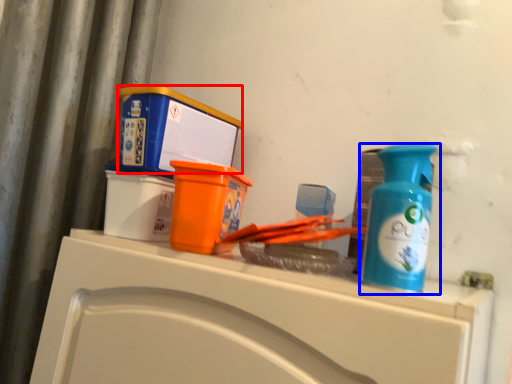
Question: Which object is further to the camera taking this photo, box (highlighted by a red box) or bottle (highlighted by a blue box)?

Choices:
 (A) box
 (B) bottle

Answer: (A)